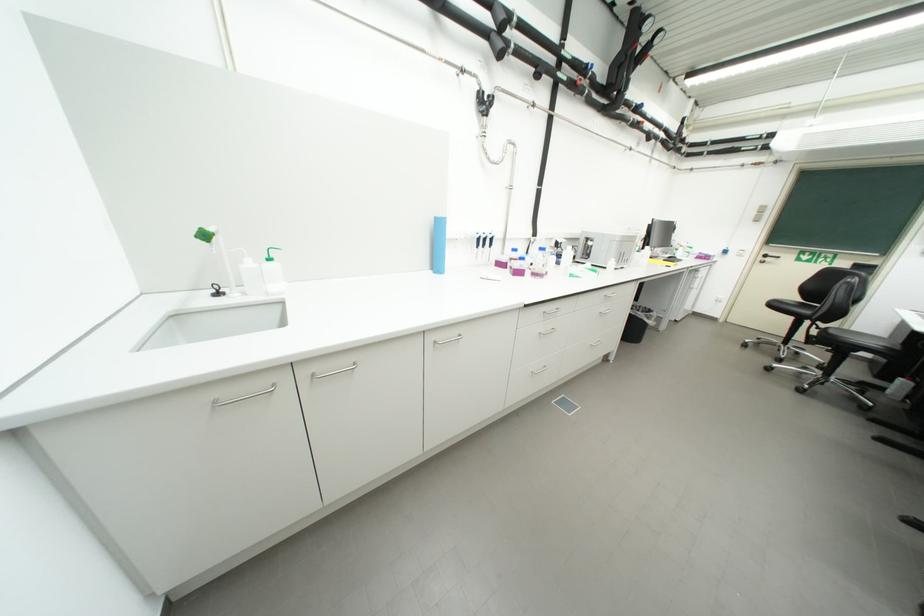
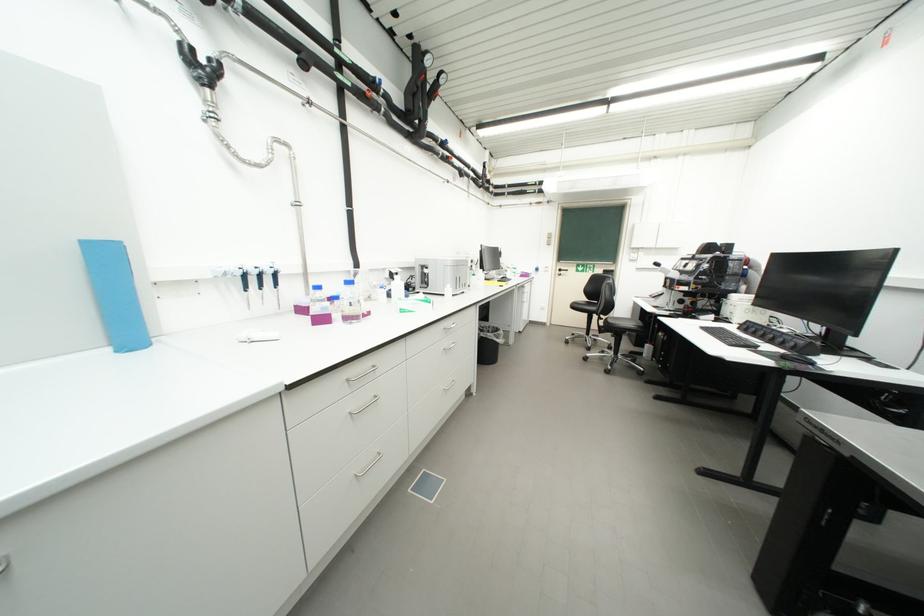
Question: The camera is either moving clockwise (left) or counter-clockwise (right) around the object. The first image is from the beginning of the video and the second image is from the end. Is the camera moving left or right when shooting the video?

Choices:
 (A) Left
 (B) Right

Answer: (A)